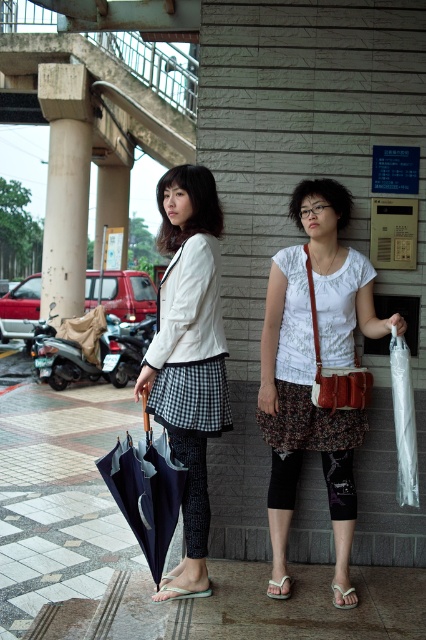
You are a delivery person standing on the polished concrete pavement at center and need to hand over a package to someone holding the rustic felt crossbody bag at center. Can you reach them without moving from your current position?

The polished concrete pavement at center is 4.03 feet from rustic felt crossbody bag at center. Since the distance is about 4 feet, you can likely reach them by stretching your arm, as the average human arm length is around 2.5 to 3 feet. However, if the package is heavy or you need to ensure a safe handover, moving closer might be advisable.

You are a delivery person who needs to place a large package between the white cotton shirt at center and the concrete column at center. Which object should you place the package closer to if you want it to be farther from the smaller object?

The white cotton shirt at center is smaller than the concrete column at center. To place the package farther from the smaller object, you should position it closer to the concrete column at center.

You are a delivery person trying to place a package on the polished concrete pavement at center while avoiding the rustic felt crossbody bag at center. Can you place the package directly below the bag?

The polished concrete pavement at center is positioned under rustic felt crossbody bag at center, so placing the package directly below the bag would place it on the pavement. However, since the pavement is already under the bag, the package can be placed there without obstruction.